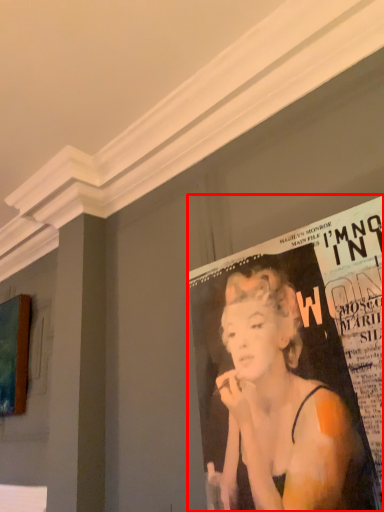
Question: Where is poster (annotated by the red box) located in relation to advertisement in the image?

Choices:
 (A) right
 (B) left

Answer: (A)